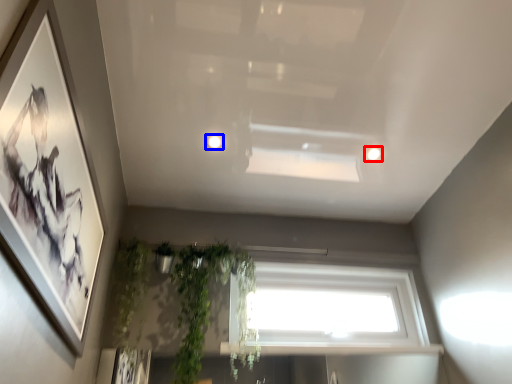
Question: Among these objects, which one is nearest to the camera, lighting (highlighted by a red box) or lighting (highlighted by a blue box)?

Choices:
 (A) lighting
 (B) lighting

Answer: (B)